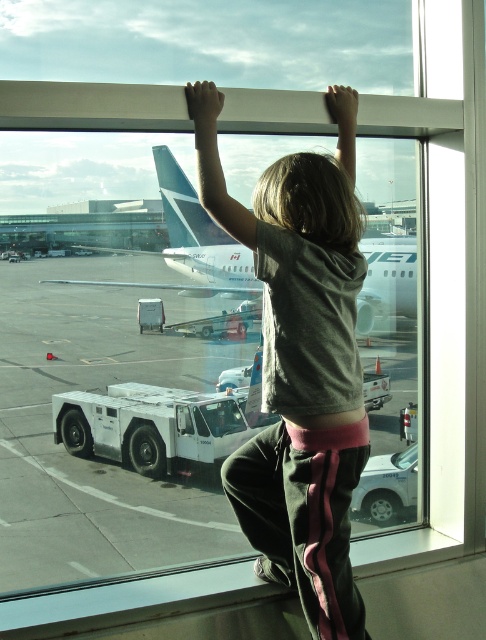
You are a security guard at the airport and need to determine which of the two points, point (346, 100) or point (382, 307), is closer to the camera. Based on the scene, which point is nearer?

Point (346, 100) is closer to the camera than point (382, 307).

You are a parent looking through the window at the airport. You see the gray cotton shirt at upper center and the white matte airplane at center. Which object is closer to you based on their positions?

The gray cotton shirt at upper center is closer to you because it is in front of the white matte airplane at center.